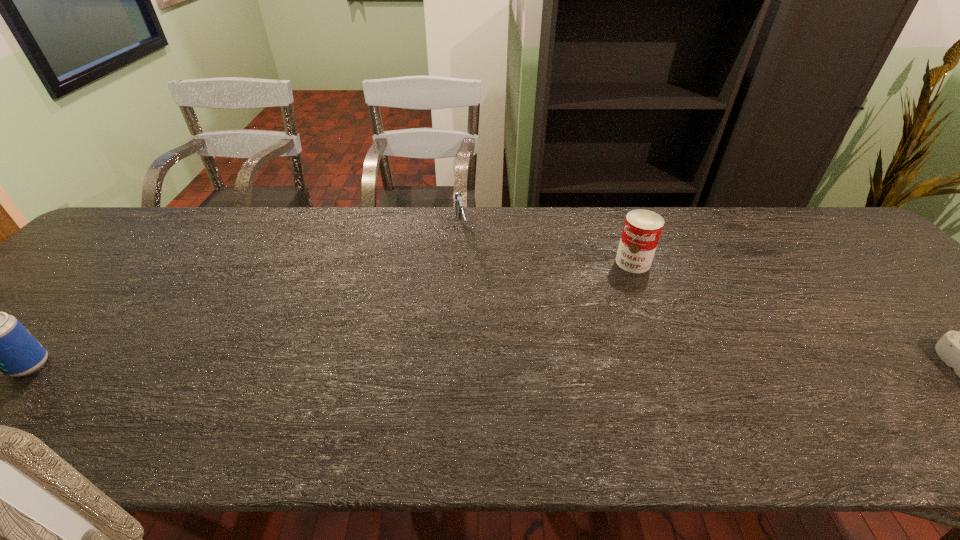
This screenshot has height=540, width=960. What are the coordinates of `free spot on the desktop that is between the leftmost object and the shortest object and is positioned at the barrel of the gun` in the screenshot? It's located at (494, 367).

The image size is (960, 540). In order to click on vacant space on the desktop that is between the beer can and the rightmost object and is positioned on the front label of the can in this screenshot , I will do `click(534, 368)`.